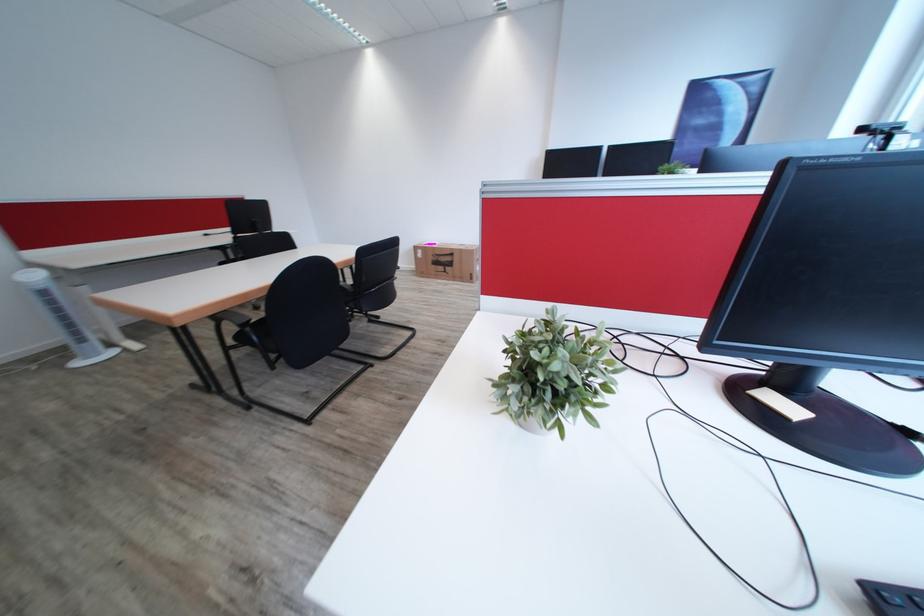
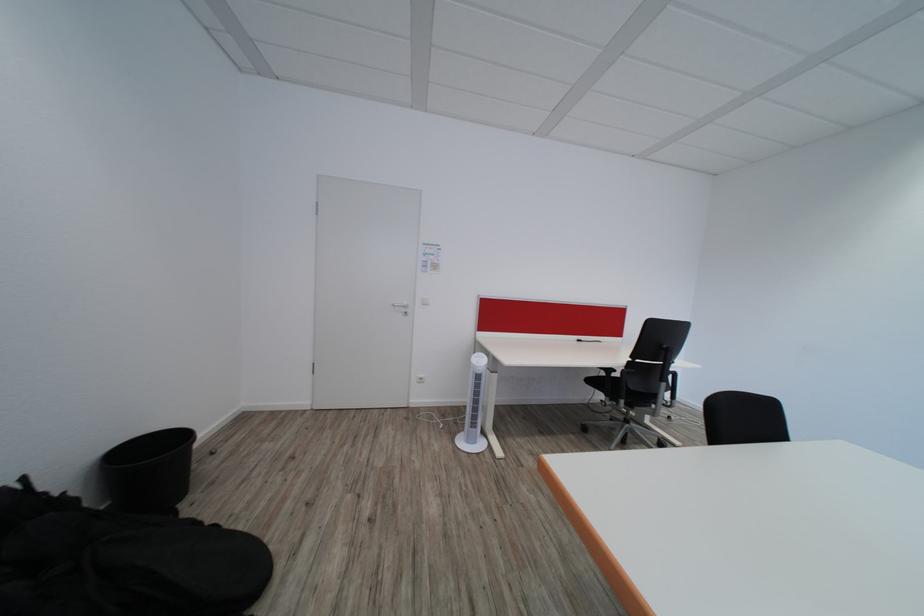
The point at (73,359) is marked in the first image. Where is the corresponding point in the second image?

(466, 424)